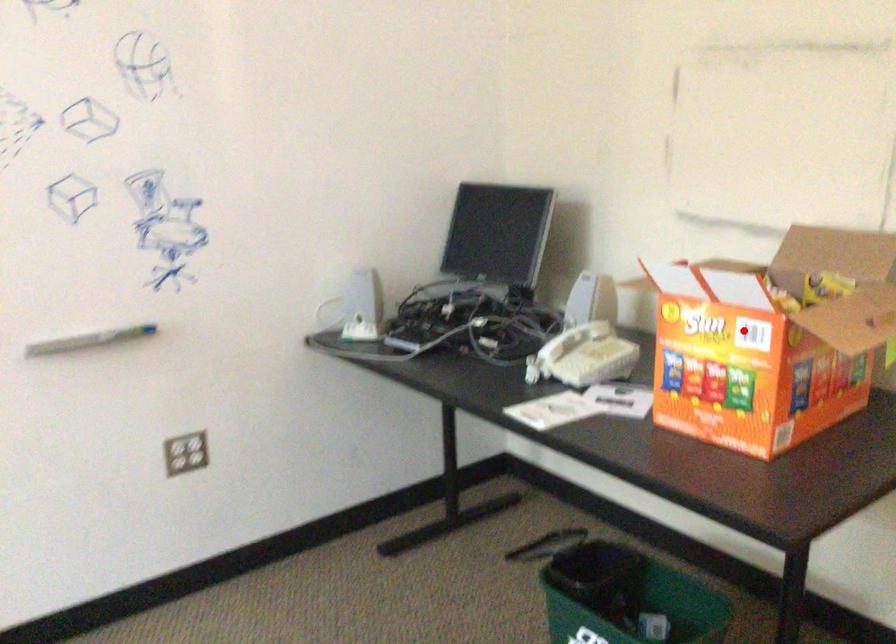
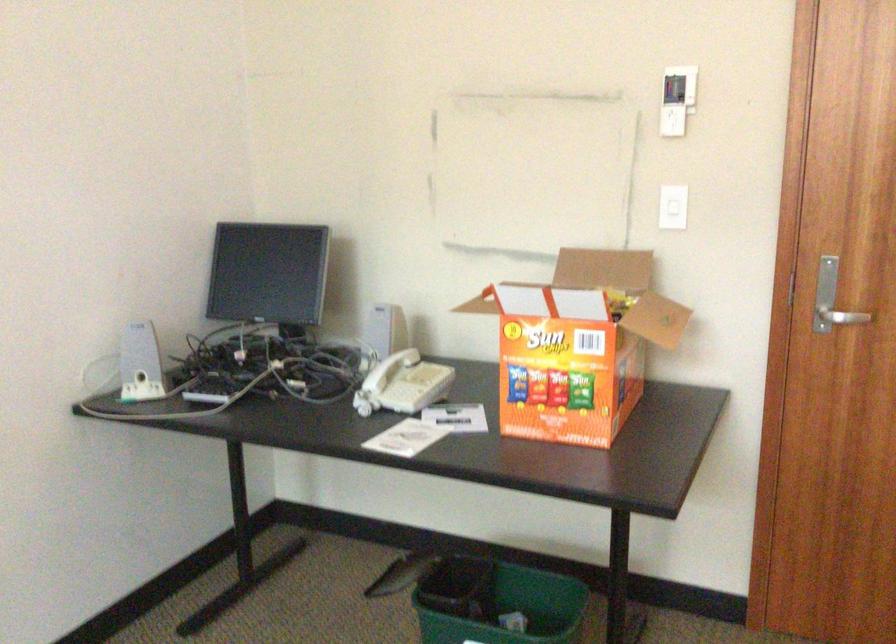
The point at the highlighted location is marked in the first image. Where is the corresponding point in the second image?

(578, 345)